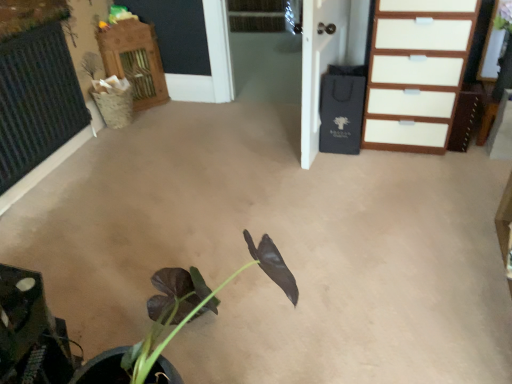
Question: Does point (344, 49) appear closer or farther from the camera than point (445, 97)?

Choices:
 (A) farther
 (B) closer

Answer: (A)

Question: Is black paper bag at upper right spatially inside white glossy chest of drawers at upper right, or outside of it?

Choices:
 (A) inside
 (B) outside

Answer: (B)

Question: Which of these objects is positioned farthest from the wooden cabinet at upper left?

Choices:
 (A) black paper bag at upper right
 (B) white glossy chest of drawers at upper right

Answer: (B)

Question: Based on their relative distances, which object is farther from the white glossy chest of drawers at upper right?

Choices:
 (A) wooden cabinet at upper left
 (B) black paper bag at upper right

Answer: (A)